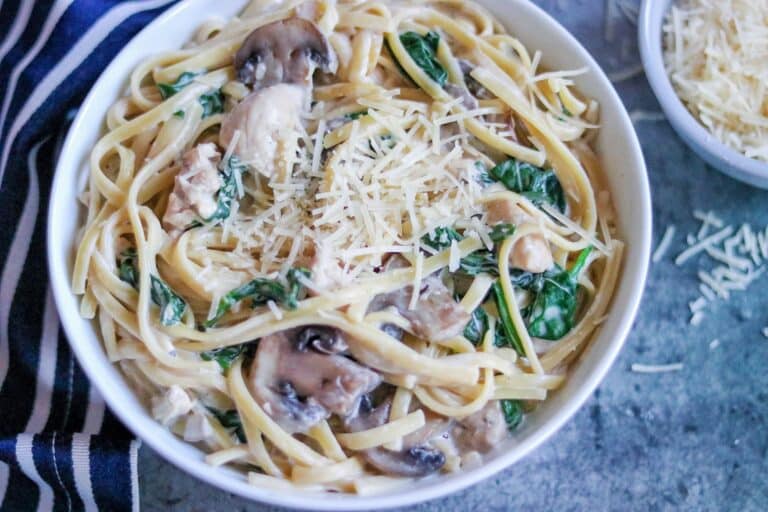
Where is `bowl`? The image size is (768, 512). bowl is located at coordinates (204, 470), (740, 169).